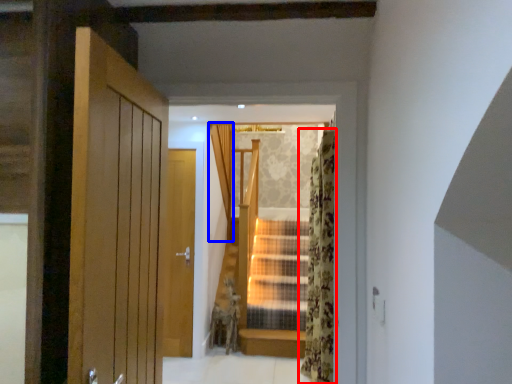
Question: Which object appears farthest to the camera in this image, curtain (highlighted by a red box) or curtain (highlighted by a blue box)?

Choices:
 (A) curtain
 (B) curtain

Answer: (B)